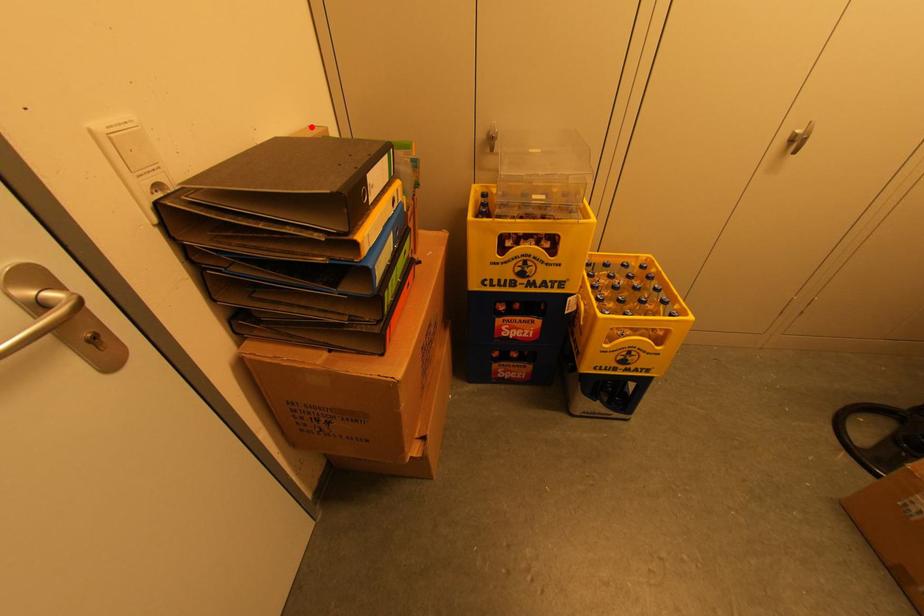
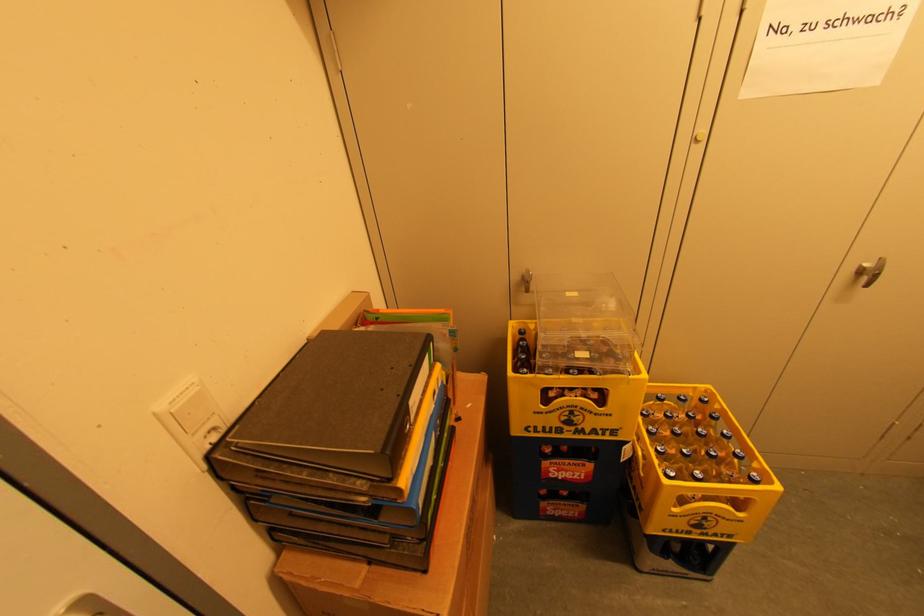
Find the pixel in the second image that matches the highlighted location in the first image.

(357, 292)